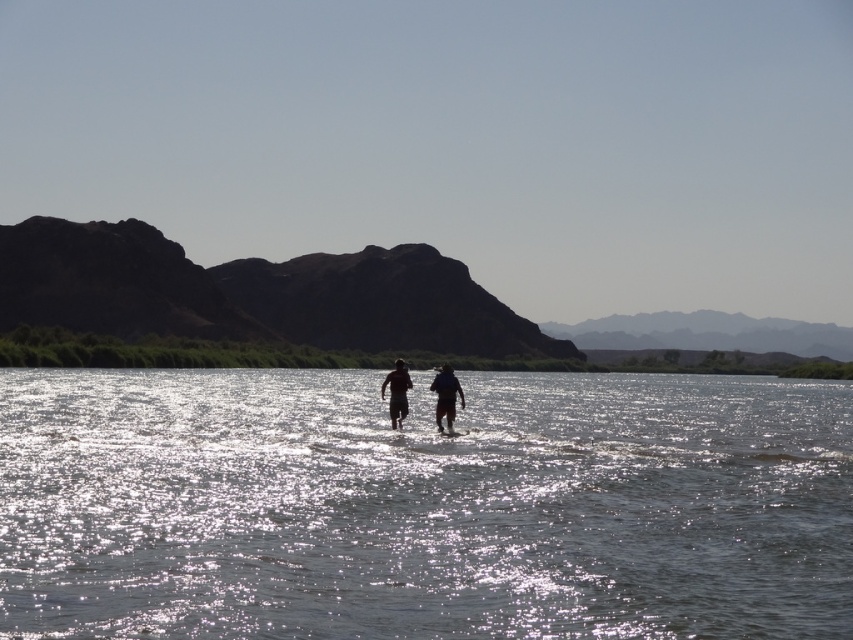
Question: Which object is closer to the camera taking this photo?

Choices:
 (A) dark blue fabric shirt at center
 (B) sparkling silver water at center
 (C) matte black shorts at center
 (D) silhouette running couple at center

Answer: (B)

Question: Is sparkling silver water at center bigger than dark blue fabric shirt at center?

Choices:
 (A) no
 (B) yes

Answer: (B)

Question: Which of the following is the closest to the observer?

Choices:
 (A) (401, 404)
 (B) (447, 371)

Answer: (A)

Question: Does silhouette running couple at center have a lesser width compared to matte black shorts at center?

Choices:
 (A) no
 (B) yes

Answer: (A)

Question: Does sparkling silver water at center have a lesser width compared to silhouette running couple at center?

Choices:
 (A) no
 (B) yes

Answer: (A)

Question: Which object is closer to the camera taking this photo?

Choices:
 (A) matte black shorts at center
 (B) sparkling silver water at center
 (C) dark blue fabric shirt at center
 (D) silhouette running couple at center

Answer: (B)